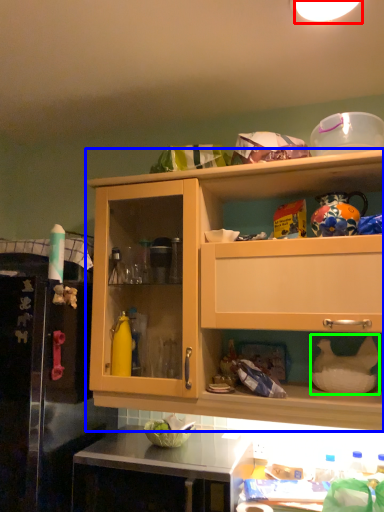
Question: Which object is positioned farthest from lighting (highlighted by a red box)? Select from cabinetry (highlighted by a blue box) and appliance (highlighted by a green box).

Choices:
 (A) cabinetry
 (B) appliance

Answer: (B)